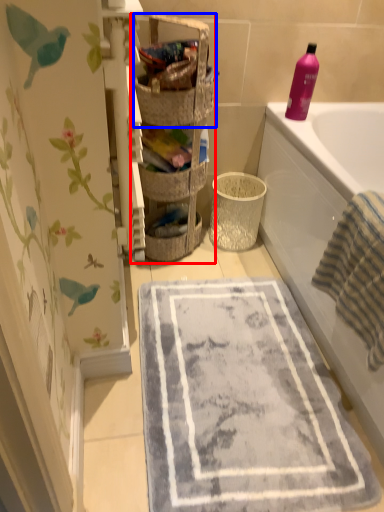
Question: Which object appears farthest to the camera in this image, shelf (highlighted by a red box) or basket (highlighted by a blue box)?

Choices:
 (A) shelf
 (B) basket

Answer: (B)